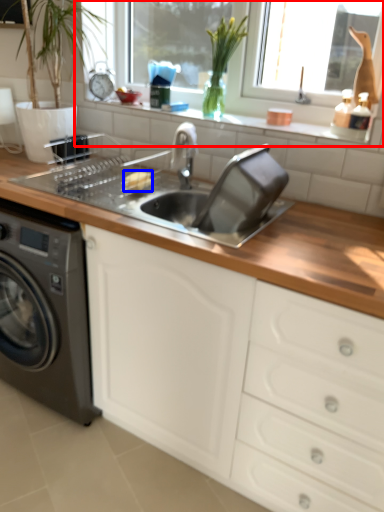
Question: Which object is closer to the camera taking this photo, window frame (highlighted by a red box) or food (highlighted by a blue box)?

Choices:
 (A) window frame
 (B) food

Answer: (A)